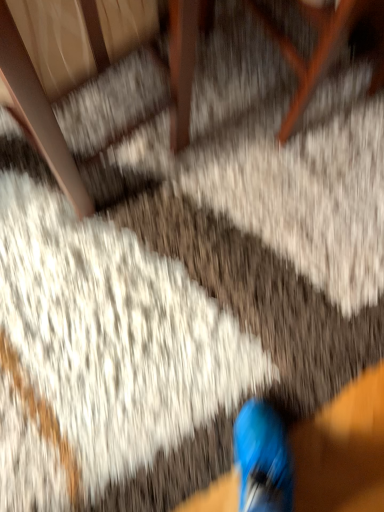
Question: Is wooden armchair at upper left situated inside wooden chair at upper right or outside?

Choices:
 (A) inside
 (B) outside

Answer: (B)

Question: Considering the positions of wooden armchair at upper left and wooden chair at upper right in the image, is wooden armchair at upper left wider or thinner than wooden chair at upper right?

Choices:
 (A) wide
 (B) thin

Answer: (B)

Question: Based on their sizes in the image, would you say wooden armchair at upper left is bigger or smaller than wooden chair at upper right?

Choices:
 (A) small
 (B) big

Answer: (B)

Question: Considering the positions of point (360, 13) and point (84, 195), is point (360, 13) closer or farther from the camera than point (84, 195)?

Choices:
 (A) farther
 (B) closer

Answer: (B)

Question: Considering the positions of wooden chair at upper right and wooden armchair at upper left in the image, is wooden chair at upper right wider or thinner than wooden armchair at upper left?

Choices:
 (A) thin
 (B) wide

Answer: (B)

Question: Would you say wooden chair at upper right is inside or outside wooden armchair at upper left?

Choices:
 (A) outside
 (B) inside

Answer: (A)

Question: From the image's perspective, relative to wooden armchair at upper left, is wooden chair at upper right above or below?

Choices:
 (A) below
 (B) above

Answer: (B)